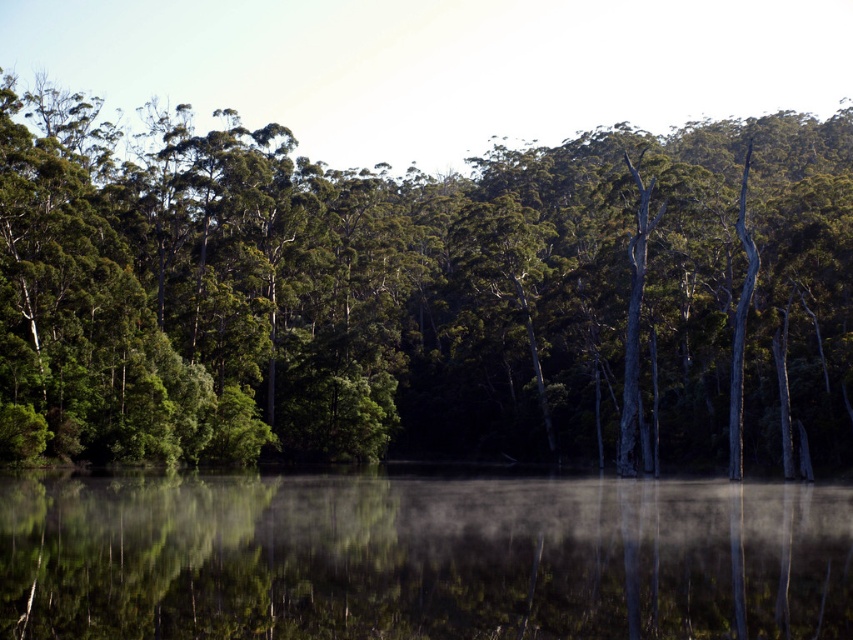
Question: Which point appears closest to the camera in this image?

Choices:
 (A) (7, 600)
 (B) (675, 246)

Answer: (A)

Question: Can you confirm if green matte tree at center is positioned to the right of transparent misty water at center?

Choices:
 (A) no
 (B) yes

Answer: (A)

Question: Which point is closer to the camera?

Choices:
 (A) (180, 116)
 (B) (828, 532)

Answer: (B)

Question: Observing the image, what is the correct spatial positioning of green matte tree at center in reference to transparent misty water at center?

Choices:
 (A) right
 (B) left

Answer: (B)

Question: Is green matte tree at center bigger than transparent misty water at center?

Choices:
 (A) yes
 (B) no

Answer: (A)